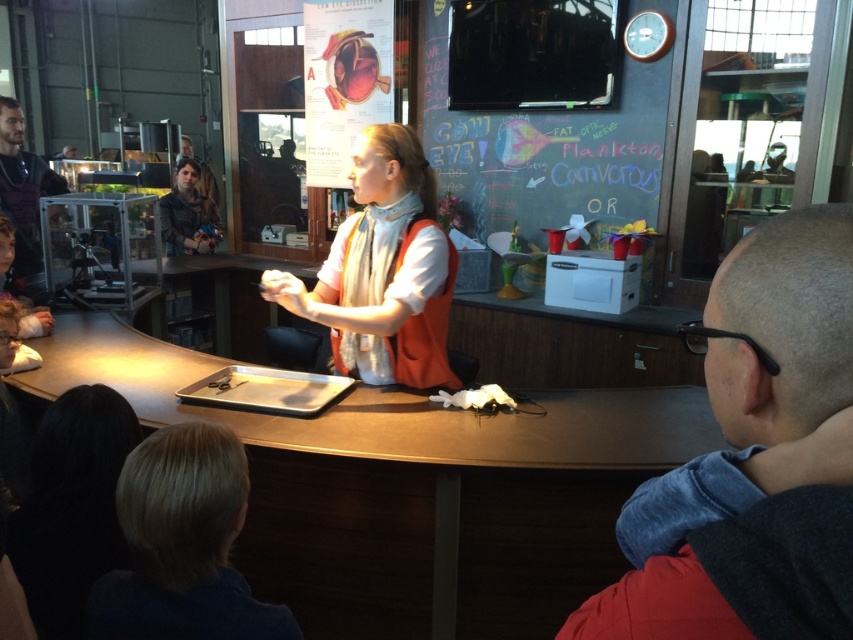
Is blonde hair at lower left wider than white matte vest at center?

No, blonde hair at lower left is not wider than white matte vest at center.

Can you confirm if blonde hair at lower left is taller than white matte vest at center?

Incorrect, blonde hair at lower left's height is not larger of white matte vest at center's.

The image size is (853, 640). Describe the element at coordinates (183, 545) in the screenshot. I see `blonde hair at lower left` at that location.

The image size is (853, 640). What are the coordinates of `blonde hair at lower left` in the screenshot? It's located at (183, 545).

Is bald head at center wider than denim jacket at upper left?

Incorrect, bald head at center's width does not surpass denim jacket at upper left's.

Between point (677, 518) and point (166, 230), which one is positioned behind?

Point (166, 230)

What do you see at coordinates (743, 422) in the screenshot? This screenshot has width=853, height=640. I see `bald head at center` at bounding box center [743, 422].

Where is `bald head at center`? bald head at center is located at coordinates pyautogui.click(x=743, y=422).

Does white matte vest at center appear over dark brown leather jacket at left?

No, white matte vest at center is not above dark brown leather jacket at left.

Is white matte vest at center smaller than dark brown leather jacket at left?

Indeed, white matte vest at center has a smaller size compared to dark brown leather jacket at left.

The height and width of the screenshot is (640, 853). What do you see at coordinates (383, 269) in the screenshot?
I see `white matte vest at center` at bounding box center [383, 269].

Where is `white matte vest at center`? white matte vest at center is located at coordinates (383, 269).